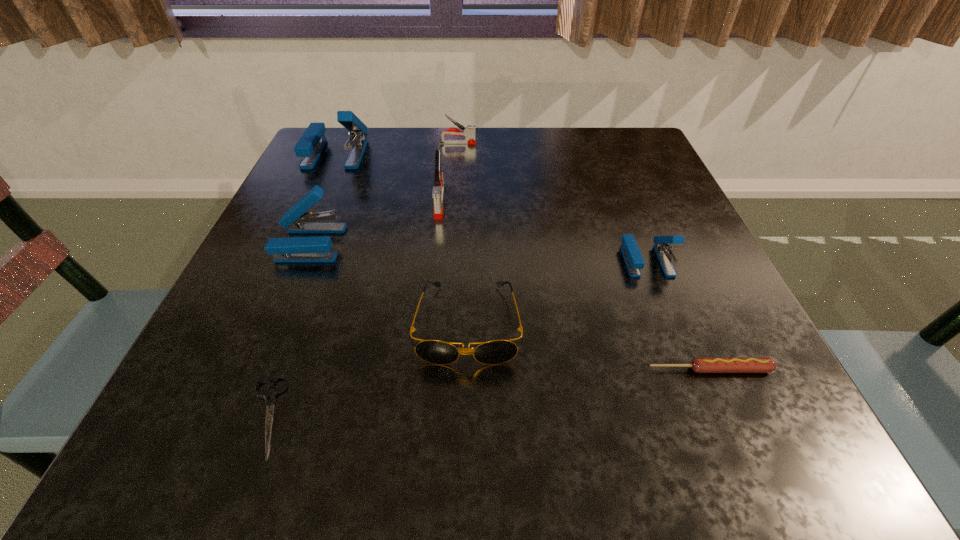
What are the coordinates of `free space located on the back of the shortest object` in the screenshot? It's located at (321, 265).

The height and width of the screenshot is (540, 960). I want to click on object present at the near edge, so click(x=270, y=395).

Locate an element on the screen. Image resolution: width=960 pixels, height=540 pixels. shears at the left edge is located at coordinates (270, 395).

Locate an element on the screen. Image resolution: width=960 pixels, height=540 pixels. stapler present at the right edge is located at coordinates click(x=634, y=261).

At what (x,y) coordinates should I click in order to perform the action: click on sausage that is at the right edge. Please return your answer as a coordinate pair (x, y). The width and height of the screenshot is (960, 540). Looking at the image, I should click on (699, 364).

Where is `object located in the far left corner section of the desktop`? The image size is (960, 540). object located in the far left corner section of the desktop is located at coordinates pos(309,147).

You are a GUI agent. You are given a task and a screenshot of the screen. Output one action in this format:
    pyautogui.click(x=<x>, y=<y>)
    Task: Click on the object located in the near left corner section of the desktop
    The image size is (960, 540).
    Given the screenshot: What is the action you would take?
    pyautogui.click(x=270, y=395)

Locate an element on the screen. The width and height of the screenshot is (960, 540). vacant space at the far edge is located at coordinates (536, 130).

You are a GUI agent. You are given a task and a screenshot of the screen. Output one action in this format:
    pyautogui.click(x=<x>, y=<y>)
    Task: Click on the free space at the near edge of the desktop
    This screenshot has width=960, height=540.
    Given the screenshot: What is the action you would take?
    pyautogui.click(x=346, y=412)

In the image, there is a desktop. Where is `free space at the left edge`? The width and height of the screenshot is (960, 540). free space at the left edge is located at coordinates (288, 208).